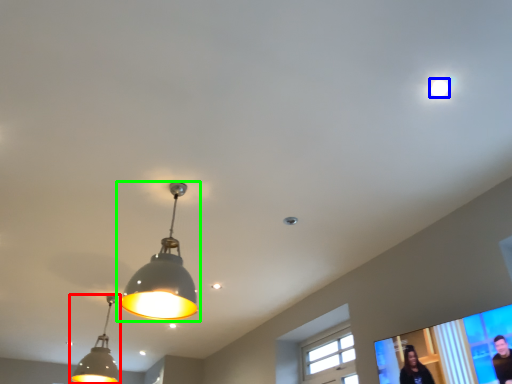
Question: Which is nearer to the lamp (highlighted by a red box)? droplight (highlighted by a blue box) or lamp (highlighted by a green box).

Choices:
 (A) droplight
 (B) lamp

Answer: (B)